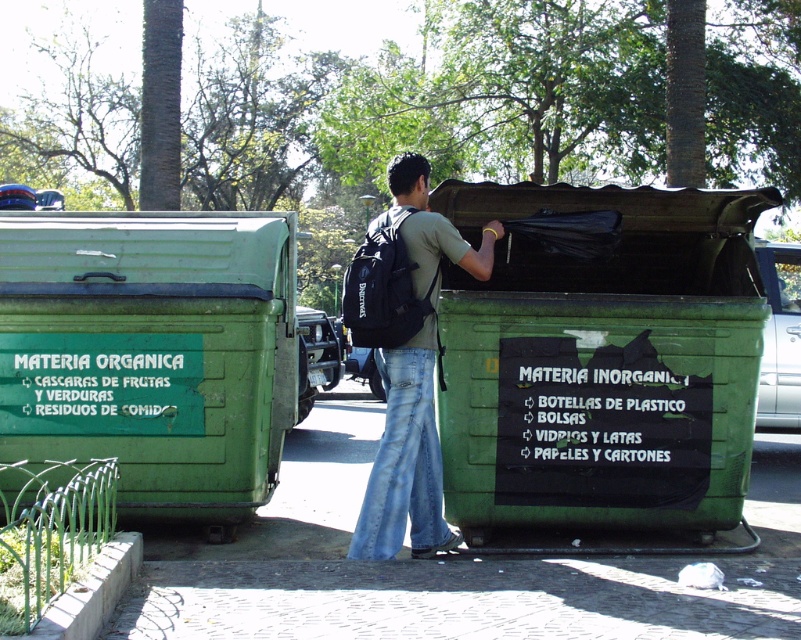
Does point (530, 250) come closer to viewer compared to point (200, 358)?

No.

Image resolution: width=801 pixels, height=640 pixels. Describe the element at coordinates (602, 358) in the screenshot. I see `green matte plastic recycling bin at center` at that location.

Is point (449, 323) positioned after point (180, 492)?

No, (449, 323) is closer to viewer.

Where is `green matte plastic recycling bin at center`? green matte plastic recycling bin at center is located at coordinates (602, 358).

Is green matte plastic recycling bin at center thinner than jeans at center?

No.

Locate an element on the screen. green matte plastic recycling bin at center is located at coordinates (602, 358).

Which is in front, point (256, 344) or point (409, 216)?

Point (409, 216)

Is green matte plastic at left to the left of jeans at center from the viewer's perspective?

Yes, green matte plastic at left is to the left of jeans at center.

Between point (153, 496) and point (369, 342), which one is positioned behind?

The point (153, 496) is behind.

The height and width of the screenshot is (640, 801). I want to click on green matte plastic at left, so click(x=151, y=353).